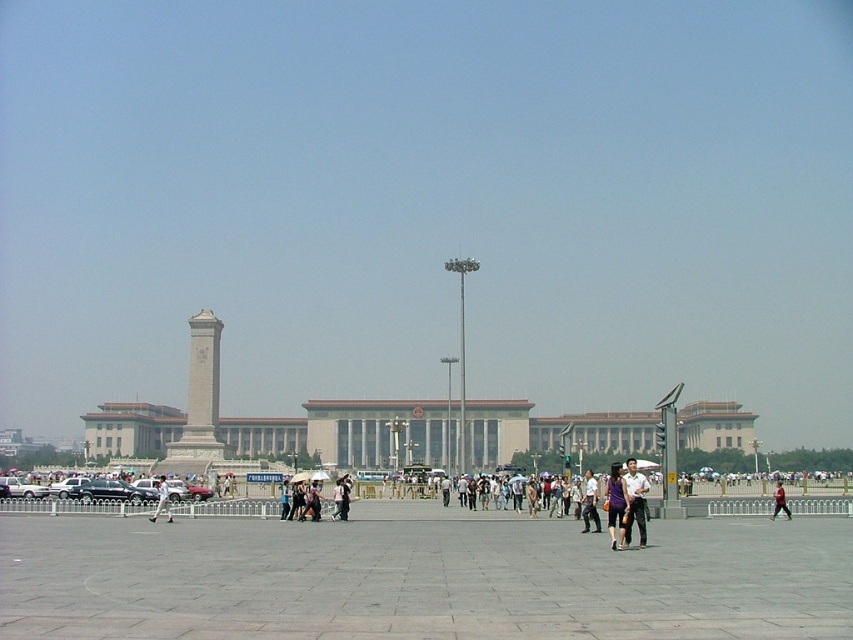
Can you confirm if purple matte dress at center is smaller than white cotton shirt at center?

No, purple matte dress at center is not smaller than white cotton shirt at center.

Who is taller, purple matte dress at center or white cotton shirt at center?

With more height is purple matte dress at center.

Which is in front, point (605, 499) or point (166, 493)?

Point (605, 499) is in front.

The image size is (853, 640). Identify the location of purple matte dress at center. (614, 506).

Measure the distance between white marble monument at center and dark purple shirt at center.

white marble monument at center and dark purple shirt at center are 55.28 meters apart from each other.

Is point (213, 392) positioned in front of point (589, 499)?

No, (213, 392) is further to viewer.

The image size is (853, 640). I want to click on white marble monument at center, so click(200, 400).

Can you confirm if white cotton shirt at center is positioned to the right of red fabric person at center?

In fact, white cotton shirt at center is to the left of red fabric person at center.

Who is taller, white cotton shirt at center or red fabric person at center?

red fabric person at center is taller.

Which is behind, point (160, 480) or point (776, 500)?

The point (160, 480) is behind.

Locate an element on the screen. white cotton shirt at center is located at coordinates pos(161,500).